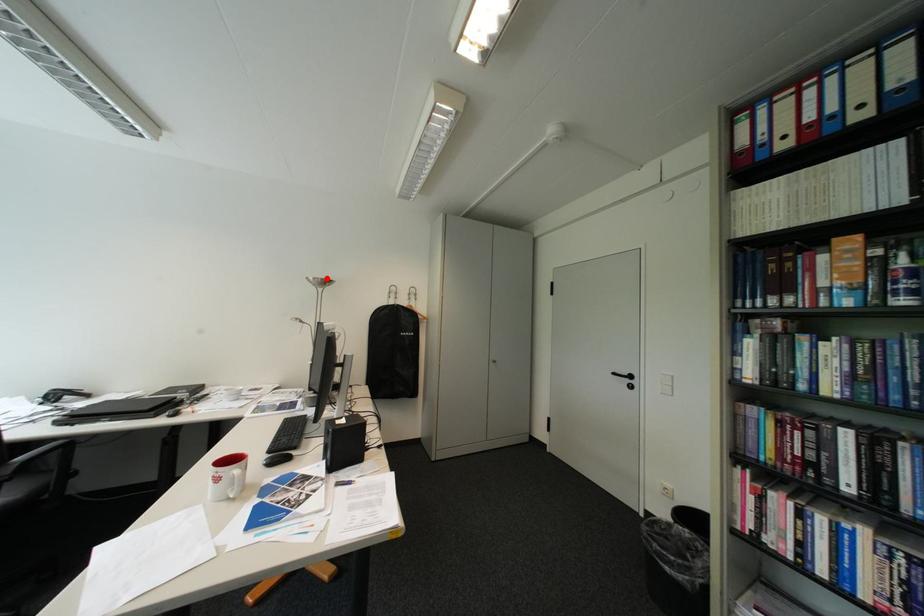
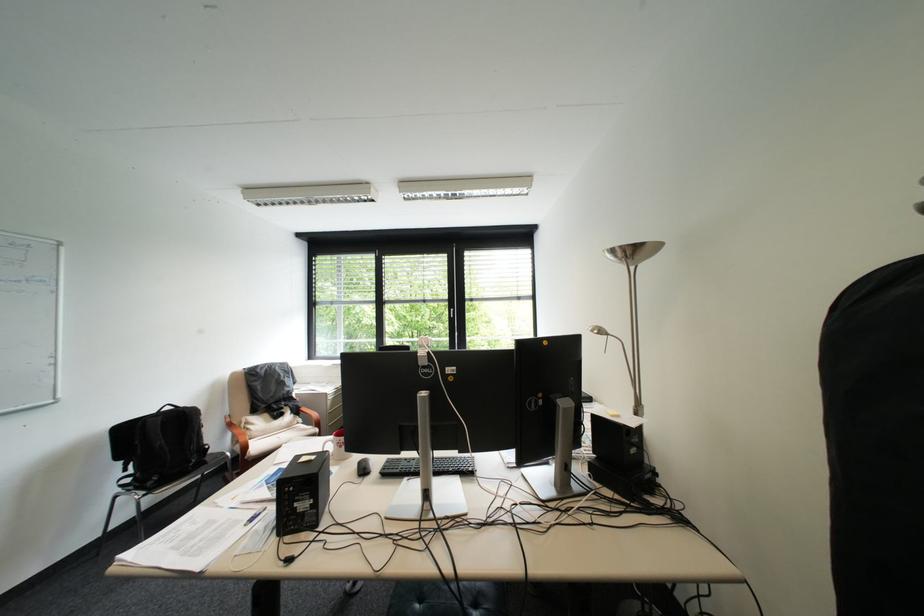
The point at the highlighted location is marked in the first image. Where is the corresponding point in the second image?

(625, 252)